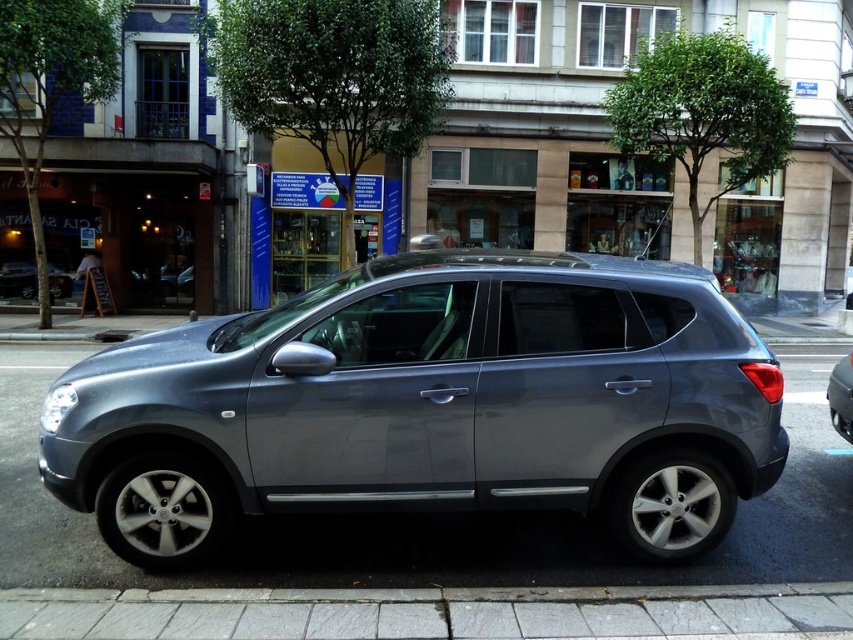
Can you confirm if satin silver suv at center is thinner than satin metallic car at center?

In fact, satin silver suv at center might be wider than satin metallic car at center.

Which is behind, point (10, 291) or point (848, 419)?

The point (10, 291) is behind.

Is point (7, 272) farther from viewer compared to point (828, 385)?

Yes.

Locate an element on the screen. satin silver suv at center is located at coordinates (18, 280).

Consider the image. Between satin metallic minivan at center and satin silver suv at center, which one has less height?

Standing shorter between the two is satin silver suv at center.

Does satin metallic minivan at center appear on the right side of satin silver suv at center?

Correct, you'll find satin metallic minivan at center to the right of satin silver suv at center.

Between point (646, 432) and point (24, 285), which one is positioned in front?

Point (646, 432)

Where is `satin metallic minivan at center`? The image size is (853, 640). satin metallic minivan at center is located at coordinates (430, 404).

What do you see at coordinates (840, 396) in the screenshot? This screenshot has height=640, width=853. I see `satin metallic car at center` at bounding box center [840, 396].

This screenshot has width=853, height=640. In order to click on satin metallic car at center in this screenshot , I will do `click(840, 396)`.